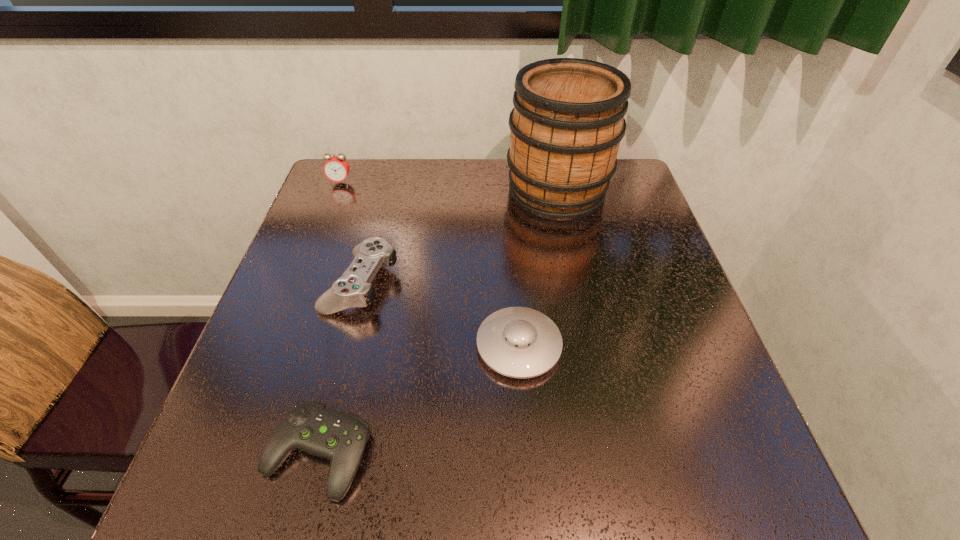
I want to click on vacant region that satisfies the following two spatial constraints: 1. on the front side of the second shortest object; 2. on the right side of the third tallest object, so click(346, 346).

Identify the location of vacant point that satisfies the following two spatial constraints: 1. on the front-facing side of the alarm clock; 2. on the left side of the farther control. This screenshot has height=540, width=960. (301, 283).